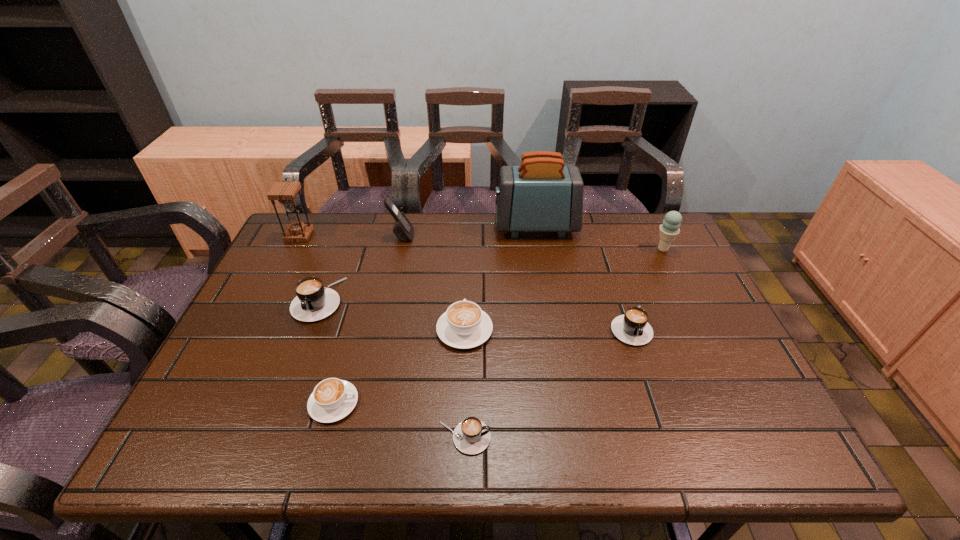
I want to click on toaster that is at the far edge, so click(541, 195).

The height and width of the screenshot is (540, 960). What are the coordinates of `hourglass that is at the far edge` in the screenshot? It's located at (285, 192).

This screenshot has width=960, height=540. I want to click on cellular telephone located at the far edge, so click(403, 229).

At what (x,y) coordinates should I click in order to perform the action: click on ice cream present at the far edge. Please return your answer as a coordinate pair (x, y). Image resolution: width=960 pixels, height=540 pixels. Looking at the image, I should click on (670, 228).

The height and width of the screenshot is (540, 960). What are the coordinates of `hourglass positioned at the left edge` in the screenshot? It's located at (285, 192).

This screenshot has width=960, height=540. I want to click on cappuccino that is at the left edge, so (x=313, y=302).

Where is `object located in the right edge section of the desktop`? Image resolution: width=960 pixels, height=540 pixels. object located in the right edge section of the desktop is located at coordinates (670, 228).

This screenshot has height=540, width=960. What are the coordinates of `object at the far left corner` in the screenshot? It's located at (285, 192).

This screenshot has height=540, width=960. What are the coordinates of `object that is at the far right corner` in the screenshot? It's located at (670, 228).

Find the location of a particular element. This screenshot has width=960, height=540. vacant space at the far edge of the desktop is located at coordinates click(x=523, y=235).